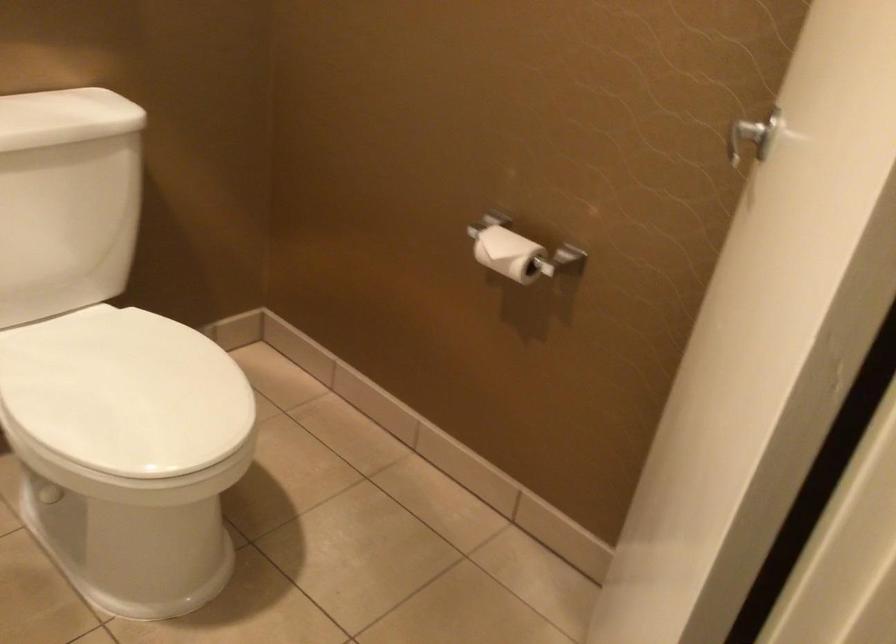
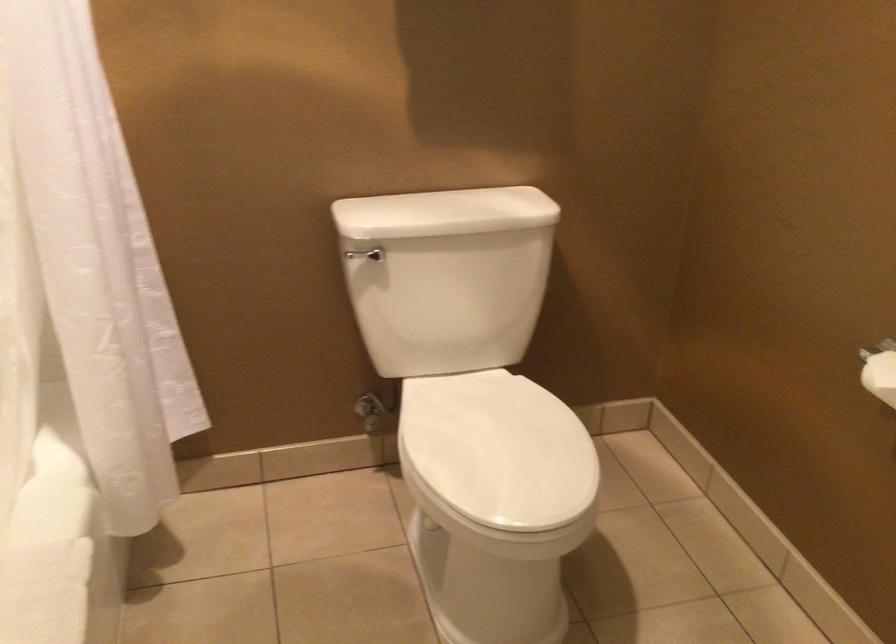
Find the pixel in the second image that matches [136,391] in the first image.

(498, 450)